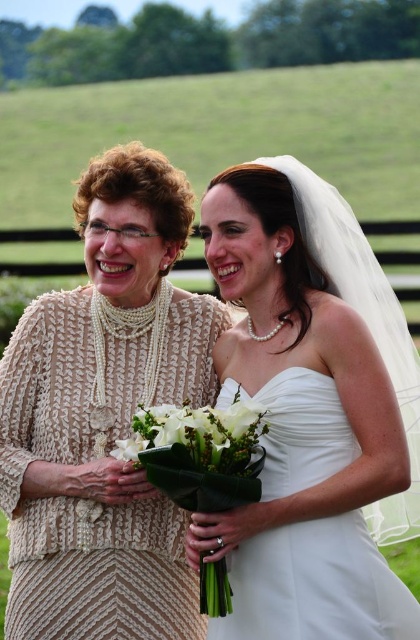
Question: Is white satin dress at center thinner than white matte flower at center?

Choices:
 (A) no
 (B) yes

Answer: (A)

Question: Which point is closer to the camera?

Choices:
 (A) white satin dress at center
 (B) knitted beige dress at left
 (C) white fabric bouquet at center

Answer: (C)

Question: From the image, what is the correct spatial relationship of knitted beige dress at left in relation to white matte flower at center?

Choices:
 (A) below
 (B) above

Answer: (B)

Question: Which point appears farthest from the camera in this image?

Choices:
 (A) (84, 392)
 (B) (118, 449)
 (C) (238, 442)

Answer: (A)

Question: Is white satin dress at center to the left of white matte flower at center from the viewer's perspective?

Choices:
 (A) yes
 (B) no

Answer: (B)

Question: Which object is closer to the camera taking this photo?

Choices:
 (A) knitted beige dress at left
 (B) white matte flower at center
 (C) white fabric bouquet at center
 (D) white satin dress at center

Answer: (C)